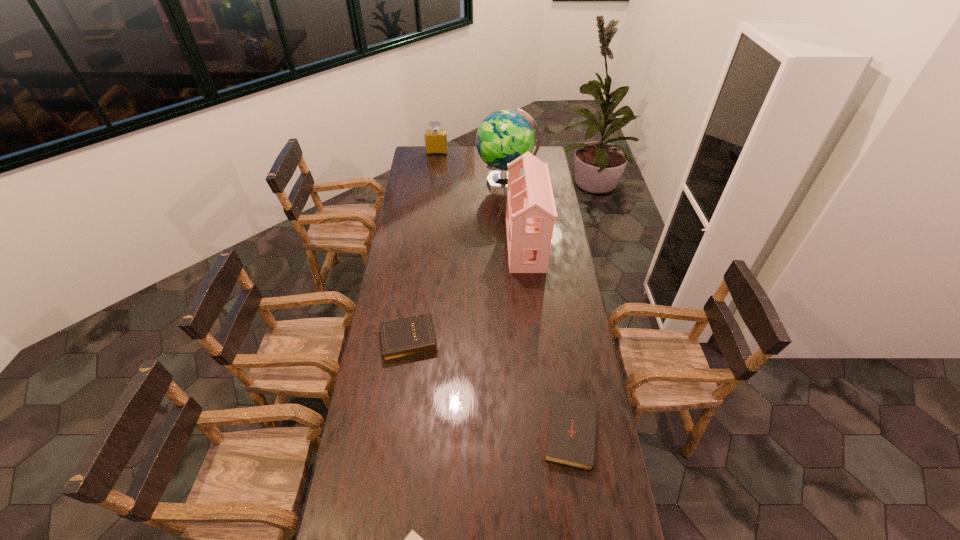
Identify the location of dollhouse that is at the right edge. The width and height of the screenshot is (960, 540). (531, 211).

Where is `Bible that is at the right edge`? This screenshot has width=960, height=540. Bible that is at the right edge is located at coordinates (572, 432).

This screenshot has width=960, height=540. Identify the location of object present at the far left corner. (435, 139).

Locate an element on the screen. Image resolution: width=960 pixels, height=540 pixels. vacant space at the left edge is located at coordinates (415, 178).

Image resolution: width=960 pixels, height=540 pixels. I want to click on free space at the right edge, so click(570, 282).

This screenshot has width=960, height=540. What are the coordinates of `free area in between the second nearest Bible and the dollhouse` in the screenshot? It's located at (548, 337).

At what (x,y) coordinates should I click in order to perform the action: click on free space that is in between the third farthest object and the fourth farthest object. Please return your answer as a coordinate pair (x, y). This screenshot has width=960, height=540. Looking at the image, I should click on (466, 292).

Identify the location of empty space that is in between the farthest Bible and the second farthest Bible. (489, 385).

Find the location of a particular element. The image size is (960, 540). free space between the farthest Bible and the farthest object is located at coordinates (421, 246).

You are a GUI agent. You are given a task and a screenshot of the screen. Output one action in this format:
    pyautogui.click(x=<x>, y=<y>)
    Task: Click on the blank region between the dollhouse and the fifth farthest object
    
    Given the screenshot: What is the action you would take?
    pyautogui.click(x=548, y=337)